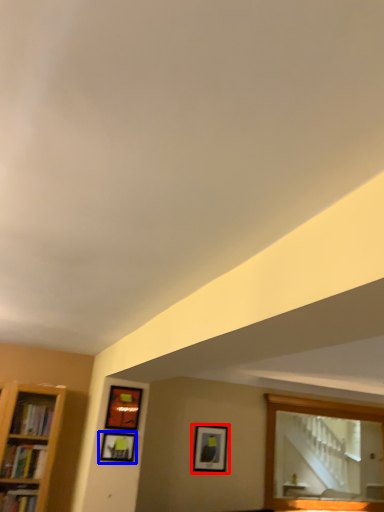
Question: Among these objects, which one is nearest to the camera, picture frame (highlighted by a red box) or picture frame (highlighted by a blue box)?

Choices:
 (A) picture frame
 (B) picture frame

Answer: (B)